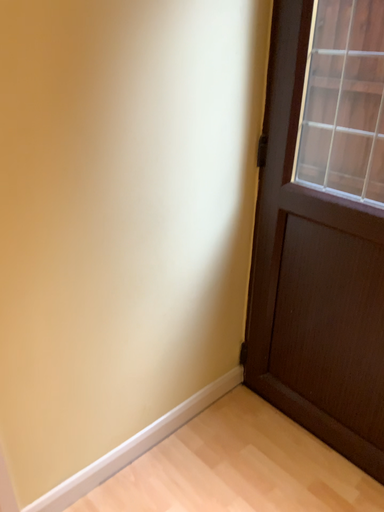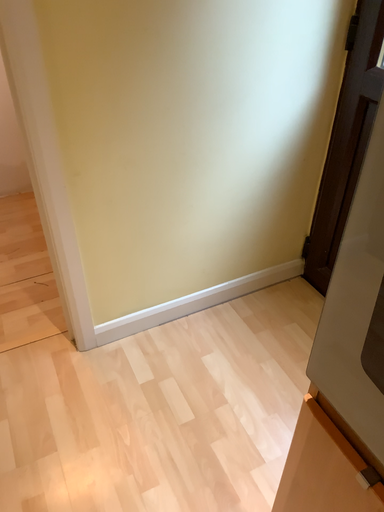
Question: Which way did the camera rotate in the video?

Choices:
 (A) rotated right
 (B) rotated left

Answer: (B)